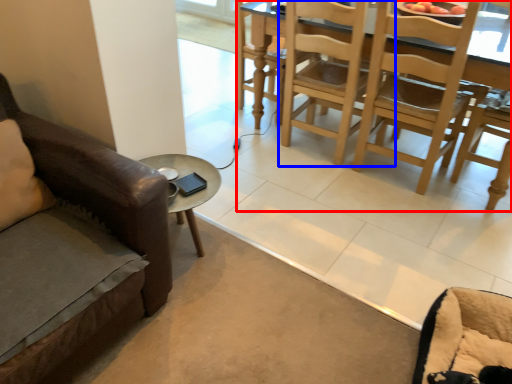
Question: Which point is closer to the camera, kitchen & dining room table (highlighted by a red box) or chair (highlighted by a blue box)?

Choices:
 (A) kitchen & dining room table
 (B) chair

Answer: (A)